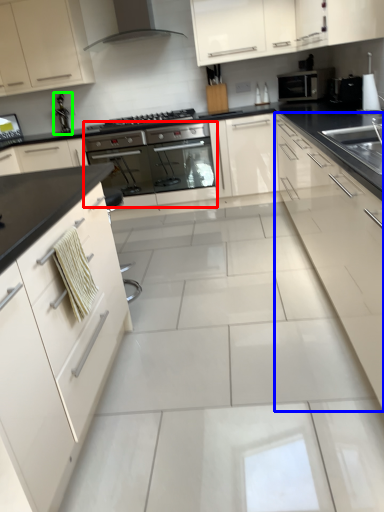
Question: Based on their relative distances, which object is farther from oven (highlighted by a red box)? Choose from cabinetry (highlighted by a blue box) and faucet (highlighted by a green box).

Choices:
 (A) cabinetry
 (B) faucet

Answer: (A)